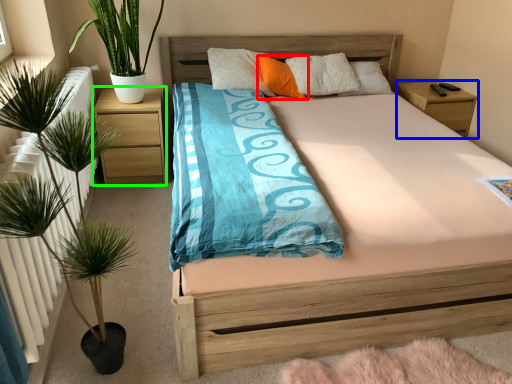
Question: Estimate the real-world distances between objects in this image. Which object is closer to pillow (highlighted by a red box), nightstand (highlighted by a blue box) or nightstand (highlighted by a green box)?

Choices:
 (A) nightstand
 (B) nightstand

Answer: (B)